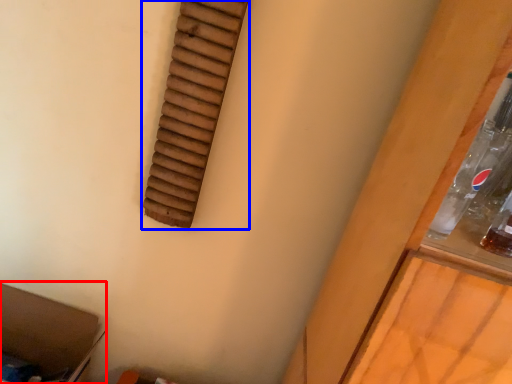
Question: Which point is further to the camera, storage box (highlighted by a red box) or window (highlighted by a blue box)?

Choices:
 (A) storage box
 (B) window

Answer: (A)